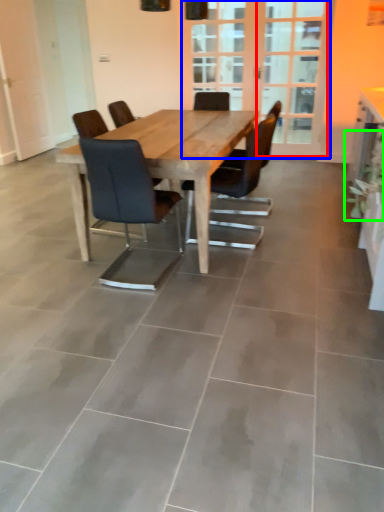
Question: Which object is the farthest from screen door (highlighted by a red box)? Choose among these: screen door (highlighted by a blue box) or plant (highlighted by a green box).

Choices:
 (A) screen door
 (B) plant

Answer: (B)